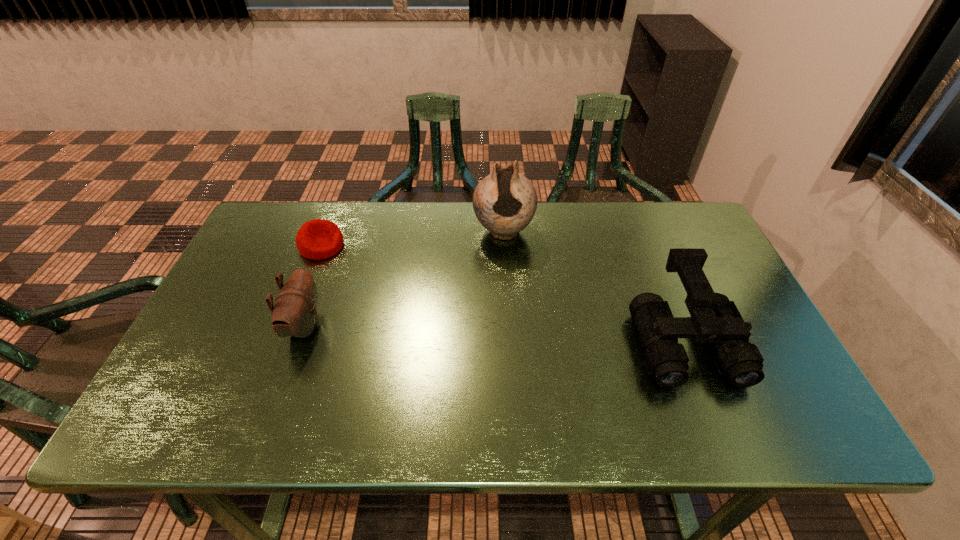
The width and height of the screenshot is (960, 540). In order to click on free space between the shortest object and the binoculars in this screenshot , I will do `click(502, 293)`.

This screenshot has height=540, width=960. I want to click on free point between the second object from right to left and the second shortest object, so click(404, 279).

Locate an element on the screen. Image resolution: width=960 pixels, height=540 pixels. vacant space in between the pottery and the pouch is located at coordinates (404, 279).

Locate which object is the second closest to the tallest object. Please provide its 2D coordinates. Your answer should be formatted as a tuple, i.e. [(x, y)], where the tuple contains the x and y coordinates of a point satisfying the conditions above.

[(317, 239)]

At what (x,y) coordinates should I click in order to perform the action: click on the second closest object to the third object from left to right. Please return your answer as a coordinate pair (x, y). The image size is (960, 540). Looking at the image, I should click on (317, 239).

Locate an element on the screen. vacant area in the image that satisfies the following two spatial constraints: 1. on the front side of the shortest object; 2. with the flap open on the second shortest object is located at coordinates (291, 326).